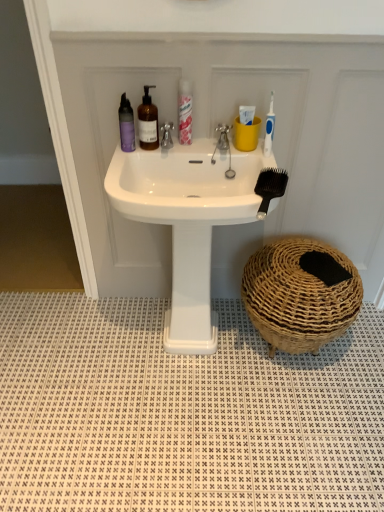
What is the approximate width of white textured tile at lower center?

The width of white textured tile at lower center is 39.20 inches.

Image resolution: width=384 pixels, height=512 pixels. I want to click on white glossy sink at center, so click(188, 220).

The image size is (384, 512). Describe the element at coordinates (300, 294) in the screenshot. I see `brown woven basket at lower right` at that location.

Locate an element on the screen. translucent pink spray can at upper center is located at coordinates (185, 112).

The width and height of the screenshot is (384, 512). Describe the element at coordinates (185, 112) in the screenshot. I see `translucent pink spray can at upper center` at that location.

In order to click on metallic silver faucet at center, acting as the 1th tap starting from the right in this screenshot , I will do `click(222, 141)`.

The image size is (384, 512). Describe the element at coordinates (126, 125) in the screenshot. I see `purple matte bottle at upper left, which is the first mouthwash in left-to-right order` at that location.

The image size is (384, 512). What do you see at coordinates (270, 187) in the screenshot?
I see `black plastic brush at center` at bounding box center [270, 187].

The height and width of the screenshot is (512, 384). Find the location of `white textured tile at lower center`. white textured tile at lower center is located at coordinates pos(182,413).

Which is in front, translucent pink spray can at upper center or brown woven basket at lower right?

translucent pink spray can at upper center is in front.

Which of these two, translucent pink spray can at upper center or brown woven basket at lower right, is thinner?

With smaller width is translucent pink spray can at upper center.

From the image's perspective, between translucent pink spray can at upper center and brown woven basket at lower right, who is located below?

brown woven basket at lower right appears lower in the image.

From their relative heights in the image, would you say translucent pink spray can at upper center is taller or shorter than brown woven basket at lower right?

Considering their sizes, translucent pink spray can at upper center has less height than brown woven basket at lower right.

Which is closer to the camera, (303, 309) or (165, 124)?

Positioned in front is point (303, 309).

Between brown woven basket at lower right and metallic silver faucet at center, the 1th tap when ordered from left to right, which one has less height?

metallic silver faucet at center, the 1th tap when ordered from left to right, is shorter.

Which is in front, metallic silver faucet at center, the second tap in the left-to-right sequence, or white glossy sink at center?

white glossy sink at center is more forward.

Is metallic silver faucet at center, the second tap in the left-to-right sequence, shorter than white glossy sink at center?

Yes, metallic silver faucet at center, the second tap in the left-to-right sequence, is shorter than white glossy sink at center.

Where is `tap located on the right of white glossy sink at center`? tap located on the right of white glossy sink at center is located at coordinates (222, 141).

Is metallic silver faucet at center, the second tap in the left-to-right sequence, positioned with its back to white glossy sink at center?

No, metallic silver faucet at center, the second tap in the left-to-right sequence,'s orientation is not away from white glossy sink at center.

Does translucent amber bottle at upper center, acting as the first mouthwash starting from the right, appear on the right side of black plastic brush at center?

In fact, translucent amber bottle at upper center, acting as the first mouthwash starting from the right, is to the left of black plastic brush at center.

How different are the orientations of translucent amber bottle at upper center, acting as the first mouthwash starting from the right, and black plastic brush at center in degrees?

The angular difference between translucent amber bottle at upper center, acting as the first mouthwash starting from the right, and black plastic brush at center is 16 degrees.

Is translucent amber bottle at upper center, acting as the first mouthwash starting from the right, taller or shorter than black plastic brush at center?

translucent amber bottle at upper center, acting as the first mouthwash starting from the right, is taller than black plastic brush at center.

Can you confirm if translucent amber bottle at upper center, which is counted as the 2th mouthwash, starting from the left, is bigger than black plastic brush at center?

Indeed, translucent amber bottle at upper center, which is counted as the 2th mouthwash, starting from the left, has a larger size compared to black plastic brush at center.

Are black plastic brush at center and translucent amber bottle at upper center, acting as the first mouthwash starting from the right, located far from each other?

black plastic brush at center is actually quite close to translucent amber bottle at upper center, acting as the first mouthwash starting from the right.

Does black plastic brush at center have a smaller size compared to translucent amber bottle at upper center, which is counted as the 2th mouthwash, starting from the left?

Indeed, black plastic brush at center has a smaller size compared to translucent amber bottle at upper center, which is counted as the 2th mouthwash, starting from the left.

Would you say black plastic brush at center is to the left or to the right of translucent amber bottle at upper center, acting as the first mouthwash starting from the right, in the picture?

Clearly, black plastic brush at center is on the right of translucent amber bottle at upper center, acting as the first mouthwash starting from the right, in the image.

Which of these two, black plastic brush at center or translucent amber bottle at upper center, which is counted as the 2th mouthwash, starting from the left, is thinner?

With smaller width is translucent amber bottle at upper center, which is counted as the 2th mouthwash, starting from the left.

From the picture: Could you tell me if metallic silver faucet at center, placed as the 2th tap when sorted from right to left, is facing metallic silver faucet at center, acting as the 1th tap starting from the right?

No, metallic silver faucet at center, placed as the 2th tap when sorted from right to left, is not turned towards metallic silver faucet at center, acting as the 1th tap starting from the right.

From a real-world perspective, is metallic silver faucet at center, placed as the 2th tap when sorted from right to left, positioned above or below metallic silver faucet at center, acting as the 1th tap starting from the right?

From a real-world perspective, metallic silver faucet at center, placed as the 2th tap when sorted from right to left, is physically above metallic silver faucet at center, acting as the 1th tap starting from the right.

How different are the orientations of metallic silver faucet at center, the 1th tap when ordered from left to right, and metallic silver faucet at center, the second tap in the left-to-right sequence, in degrees?

0.000293 degrees.

From the image's perspective, is metallic silver faucet at center, the 1th tap when ordered from left to right, located above metallic silver faucet at center, the second tap in the left-to-right sequence?

Yes, from the image's perspective, metallic silver faucet at center, the 1th tap when ordered from left to right, is above metallic silver faucet at center, the second tap in the left-to-right sequence.

What's the angular difference between brown woven basket at lower right and purple matte bottle at upper left, the 2th mouthwash viewed from the right,'s facing directions?

The angle between the facing direction of brown woven basket at lower right and the facing direction of purple matte bottle at upper left, the 2th mouthwash viewed from the right, is 0.000107 degrees.

Considering the relative sizes of brown woven basket at lower right and purple matte bottle at upper left, the 2th mouthwash viewed from the right, in the image provided, is brown woven basket at lower right shorter than purple matte bottle at upper left, the 2th mouthwash viewed from the right,?

No, brown woven basket at lower right is not shorter than purple matte bottle at upper left, the 2th mouthwash viewed from the right.

Is brown woven basket at lower right smaller than purple matte bottle at upper left, which is the first mouthwash in left-to-right order?

No, brown woven basket at lower right is not smaller than purple matte bottle at upper left, which is the first mouthwash in left-to-right order.

Is brown woven basket at lower right inside or outside of purple matte bottle at upper left, which is the first mouthwash in left-to-right order?

brown woven basket at lower right lies outside purple matte bottle at upper left, which is the first mouthwash in left-to-right order.

This screenshot has width=384, height=512. In order to click on basket located underneath the translucent pink spray can at upper center (from a real-world perspective) in this screenshot , I will do `click(300, 294)`.

You are a GUI agent. You are given a task and a screenshot of the screen. Output one action in this format:
    pyautogui.click(x=<x>, y=<y>)
    Task: Click on the basket below the metallic silver faucet at center, the 1th tap when ordered from left to right (from the image's perspective)
    Image resolution: width=384 pixels, height=512 pixels.
    Given the screenshot: What is the action you would take?
    pyautogui.click(x=300, y=294)

Considering their positions, is blue plastic toothbrush at upper right positioned further to white glossy sink at center than metallic silver faucet at center, the 1th tap when ordered from left to right?

blue plastic toothbrush at upper right is positioned further to the anchor white glossy sink at center.

Which object lies nearer to the anchor point translucent amber bottle at upper center, acting as the first mouthwash starting from the right, blue plastic toothbrush at upper right or purple matte bottle at upper left, which is the first mouthwash in left-to-right order?

purple matte bottle at upper left, which is the first mouthwash in left-to-right order, is closer to translucent amber bottle at upper center, acting as the first mouthwash starting from the right.

Considering their positions, is purple matte bottle at upper left, which is the first mouthwash in left-to-right order, positioned further to translucent pink spray can at upper center than white textured tile at lower center?

The object further to translucent pink spray can at upper center is white textured tile at lower center.

Considering their positions, is metallic silver faucet at center, placed as the 2th tap when sorted from right to left, positioned further to translucent pink spray can at upper center than black plastic brush at center?

black plastic brush at center.

When comparing their distances from translucent pink spray can at upper center, does white textured tile at lower center or brown woven basket at lower right seem further?

white textured tile at lower center.

Considering their positions, is blue plastic toothbrush at upper right positioned further to translucent pink spray can at upper center than white textured tile at lower center?

Among the two, white textured tile at lower center is located further to translucent pink spray can at upper center.

From the image, which object appears to be nearer to translucent pink spray can at upper center, black plastic brush at center or translucent amber bottle at upper center, acting as the first mouthwash starting from the right?

translucent amber bottle at upper center, acting as the first mouthwash starting from the right, is closer to translucent pink spray can at upper center.

Based on their spatial positions, is blue plastic toothbrush at upper right or white glossy sink at center closer to metallic silver faucet at center, placed as the 2th tap when sorted from right to left?

Among the two, blue plastic toothbrush at upper right is located nearer to metallic silver faucet at center, placed as the 2th tap when sorted from right to left.

I want to click on sink between translucent amber bottle at upper center, acting as the first mouthwash starting from the right, and brown woven basket at lower right from top to bottom, so click(x=188, y=220).

This screenshot has width=384, height=512. In order to click on tap between translucent pink spray can at upper center and blue plastic toothbrush at upper right in the horizontal direction in this screenshot , I will do `click(222, 141)`.

The width and height of the screenshot is (384, 512). In order to click on sink between purple matte bottle at upper left, the 2th mouthwash viewed from the right, and brown woven basket at lower right vertically in this screenshot , I will do `click(188, 220)`.

Image resolution: width=384 pixels, height=512 pixels. I want to click on toothbrush between translucent amber bottle at upper center, acting as the first mouthwash starting from the right, and brown woven basket at lower right vertically, so click(269, 128).